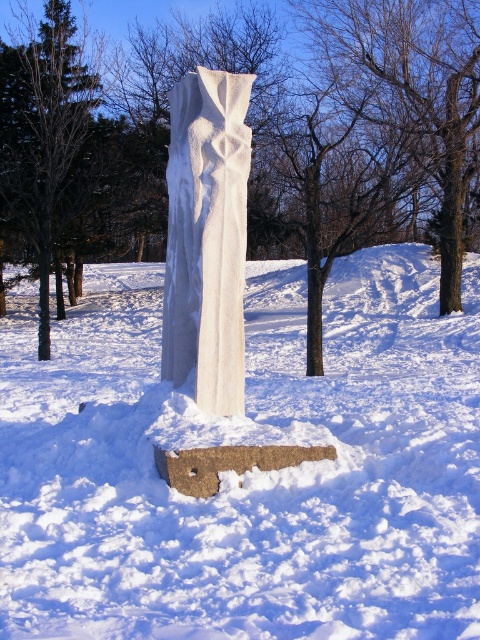
Is white textured stone at center taller than brown bark tree at center?

Incorrect, white textured stone at center's height is not larger of brown bark tree at center's.

The height and width of the screenshot is (640, 480). Find the location of `white textured stone at center`. white textured stone at center is located at coordinates (252, 472).

Image resolution: width=480 pixels, height=640 pixels. What are the coordinates of `white textured stone at center` in the screenshot? It's located at (252, 472).

Which is in front, point (84, 477) or point (274, 45)?

Point (84, 477) is more forward.

Does point (417, 605) lie in front of point (325, 186)?

Yes, point (417, 605) is closer to viewer.

Where is `white textured stone at center`? The width and height of the screenshot is (480, 640). white textured stone at center is located at coordinates (252, 472).

Where is `white textured stone at center`? The width and height of the screenshot is (480, 640). white textured stone at center is located at coordinates (252, 472).

Is point (271, 29) positioned after point (239, 129)?

Yes.

Can you confirm if white stone column at center is positioned to the left of white marble column at center?

Yes, white stone column at center is to the left of white marble column at center.

Locate an element on the screen. The image size is (480, 640). white stone column at center is located at coordinates (312, 132).

Locate an element on the screen. white stone column at center is located at coordinates (312, 132).